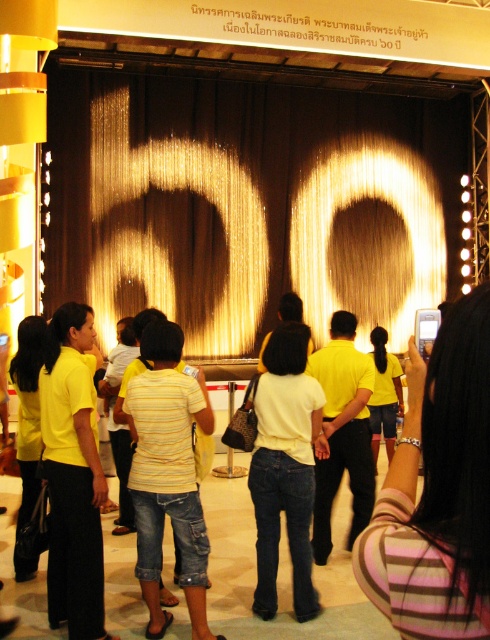
Which is below, light yellow shirt at center or matte yellow shirt at center?

light yellow shirt at center is lower down.

Does light yellow shirt at center have a lesser height compared to matte yellow shirt at center?

Correct, light yellow shirt at center is not as tall as matte yellow shirt at center.

Who is more forward, [264,400] or [27,396]?

Point [264,400] is more forward.

Locate an element on the screen. This screenshot has width=490, height=640. light yellow shirt at center is located at coordinates (286, 467).

Who is positioned more to the right, light yellow shirt at center or yellow fabric shorts at center?

yellow fabric shorts at center is more to the right.

Is light yellow shirt at center positioned at the back of yellow fabric shorts at center?

No, light yellow shirt at center is closer to the viewer.

Find the location of a particular element. The width and height of the screenshot is (490, 640). light yellow shirt at center is located at coordinates (286, 467).

In order to click on light yellow shirt at center in this screenshot , I will do `click(286, 467)`.

Looking at this image, between matte yellow shirt at center and yellow fabric shorts at center, which one appears on the left side from the viewer's perspective?

Positioned to the left is matte yellow shirt at center.

Does point (33, 424) come in front of point (377, 353)?

Yes, point (33, 424) is in front of point (377, 353).

I want to click on matte yellow shirt at center, so click(x=27, y=428).